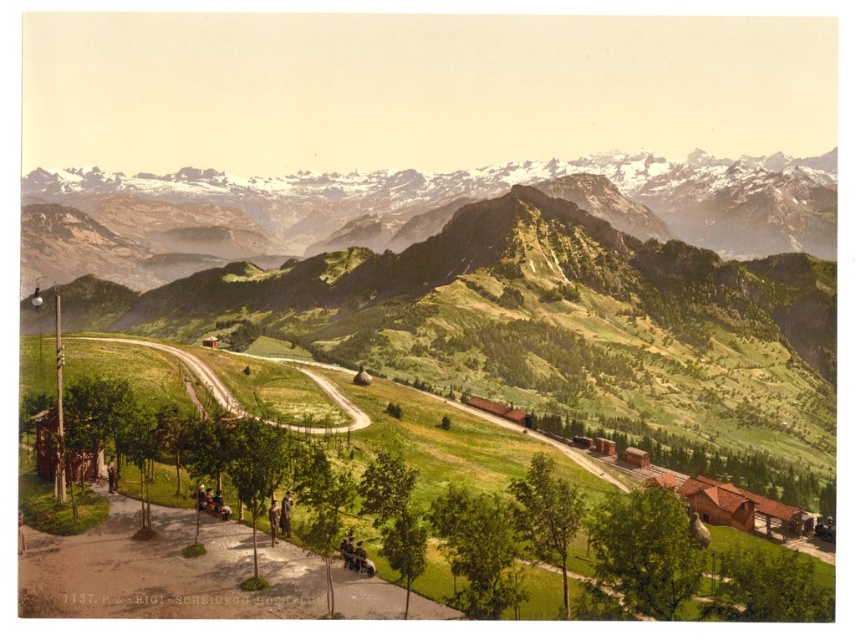
Can you confirm if green grassy hillside at center is positioned to the left of green grassy mountain at upper center?

Incorrect, green grassy hillside at center is not on the left side of green grassy mountain at upper center.

Is the position of green grassy hillside at center less distant than that of green grassy mountain at upper center?

Yes.

Who is more forward, (703, 198) or (562, 196)?

Positioned in front is point (562, 196).

This screenshot has width=856, height=640. What are the coordinates of `green grassy hillside at center` in the screenshot? It's located at (512, 291).

Does green grassy hillside at center have a lesser width compared to brown wooden houses at lower right?

No.

Consider the image. Does green grassy hillside at center appear on the left side of brown wooden houses at lower right?

In fact, green grassy hillside at center is to the right of brown wooden houses at lower right.

Is point (700, 266) closer to viewer compared to point (783, 540)?

No, (700, 266) is further to viewer.

What are the coordinates of `green grassy hillside at center` in the screenshot? It's located at (512, 291).

Is green grassy mountain at upper center above brown wooden houses at lower right?

Indeed, green grassy mountain at upper center is positioned over brown wooden houses at lower right.

Where is `green grassy mountain at upper center`? This screenshot has height=640, width=856. green grassy mountain at upper center is located at coordinates (413, 209).

Where is `green grassy mountain at upper center`? The width and height of the screenshot is (856, 640). green grassy mountain at upper center is located at coordinates (413, 209).